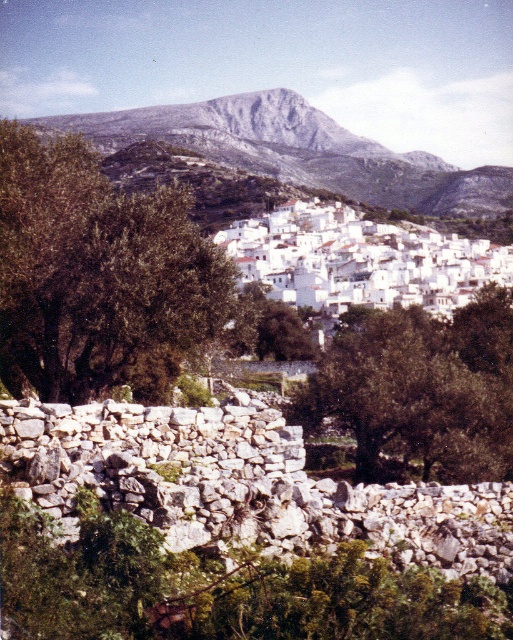
You are standing in the village and want to take a photo of the green leafy tree at center and the rugged stone mountain at upper center. Which object should you focus on first if you want both to be in the same frame without moving the camera?

The green leafy tree at center is below the rugged stone mountain at upper center, so you should focus on the green leafy tree at center first to ensure both are in the frame.

You are standing at the base of the hill in the image. There is a point marked at coordinates (98, 276). What object is located at that point?

The point at coordinates (98, 276) marks a green leafy tree at the left side of the image.